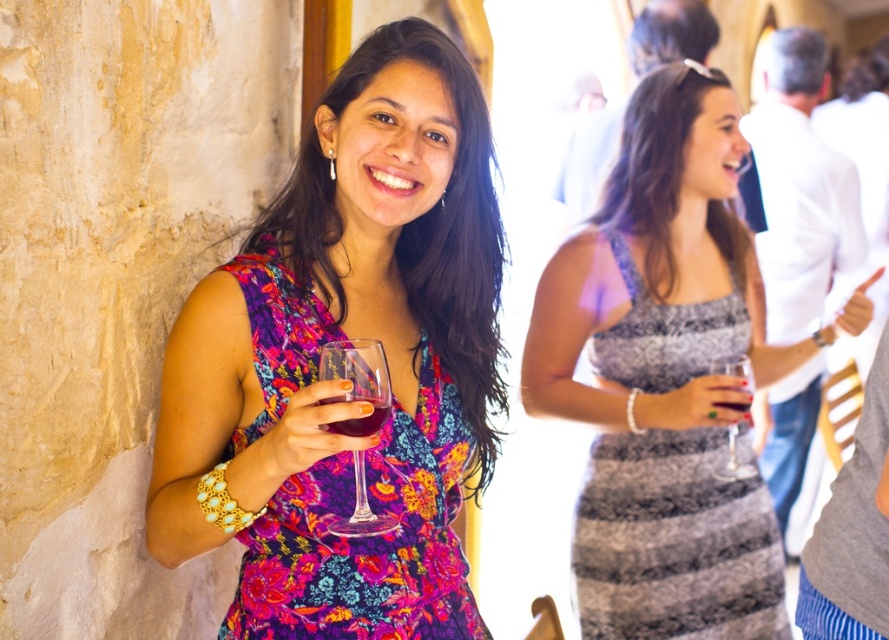
Question: Among these objects, which one is nearest to the camera?

Choices:
 (A) translucent glass at center
 (B) translucent glass wine at center

Answer: (B)

Question: Is the position of gray textured dress at center less distant than that of translucent glass at center?

Choices:
 (A) yes
 (B) no

Answer: (B)

Question: Does transparent glass wine glass at left appear under transparent glass at center?

Choices:
 (A) yes
 (B) no

Answer: (B)

Question: Which of these objects is positioned closest to the transparent glass at center?

Choices:
 (A) gray lace dress at upper center
 (B) translucent glass wine at center
 (C) gray textured dress at center
 (D) floral fabric dress at center

Answer: (C)

Question: Observing the image, what is the correct spatial positioning of gray textured dress at center in reference to transparent glass at center?

Choices:
 (A) right
 (B) left

Answer: (B)

Question: Which object is closer to the camera taking this photo?

Choices:
 (A) gray textured dress at center
 (B) translucent glass wine at center
 (C) translucent glass at center
 (D) gray lace dress at upper center

Answer: (B)